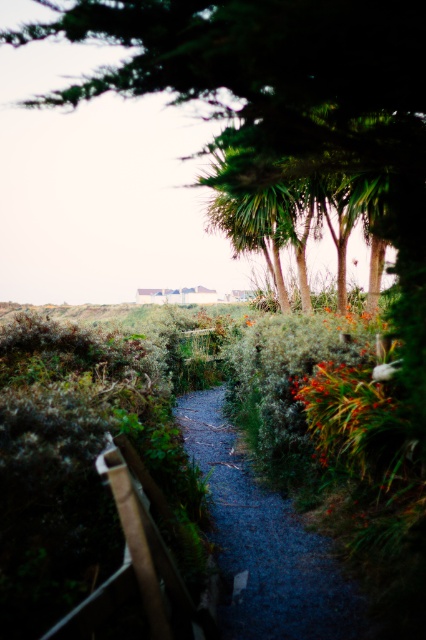
Question: Considering the relative positions of green leafy tree at upper center and dark gray gravel path at center in the image provided, where is green leafy tree at upper center located with respect to dark gray gravel path at center?

Choices:
 (A) left
 (B) right

Answer: (A)

Question: Based on their relative distances, which object is farther from the green fuzzy plant at center?

Choices:
 (A) dark gray gravel path at center
 (B) green leafy tree at upper center

Answer: (B)

Question: Which of the following is the closest to the observer?

Choices:
 (A) (340, 444)
 (B) (132, 45)
 (C) (342, 604)

Answer: (C)

Question: Does green leafy tree at upper center appear under green fuzzy plant at center?

Choices:
 (A) yes
 (B) no

Answer: (B)

Question: From the image, what is the correct spatial relationship of dark gray gravel path at center in relation to green fuzzy plant at center?

Choices:
 (A) below
 (B) above

Answer: (A)

Question: Which of these objects is positioned closest to the dark gray gravel path at center?

Choices:
 (A) green fuzzy plant at center
 (B) green leafy tree at upper center

Answer: (A)